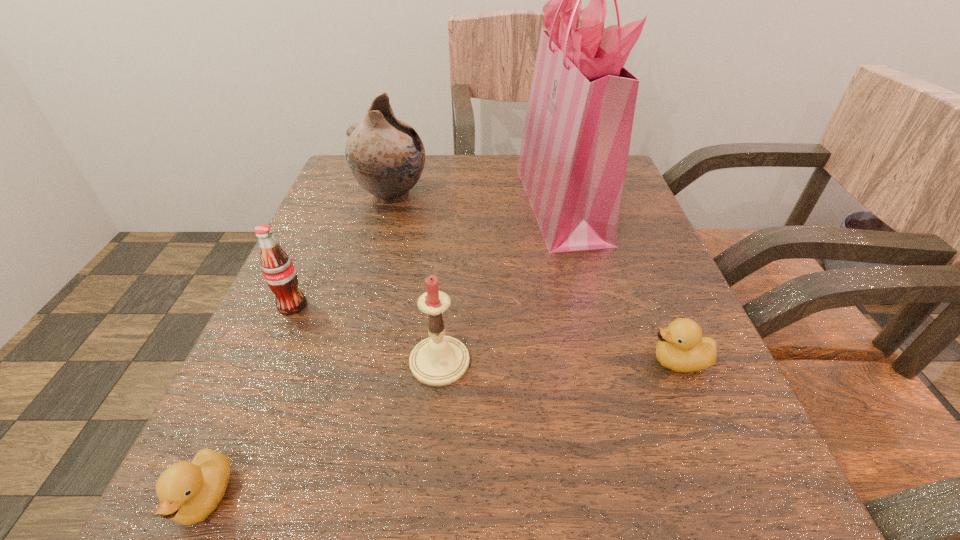
You are a GUI agent. You are given a task and a screenshot of the screen. Output one action in this format:
    pyautogui.click(x=<x>, y=<y>)
    Task: Click on the vacant space at the far left corner
    This screenshot has width=960, height=540.
    Given the screenshot: What is the action you would take?
    pyautogui.click(x=363, y=204)

In the image, there is a desktop. Identify the location of blank space at the near right corner. The height and width of the screenshot is (540, 960). (709, 496).

The image size is (960, 540). What are the coordinates of `free area in between the nearer duckling and the fourth nearest object` in the screenshot? It's located at (249, 401).

The height and width of the screenshot is (540, 960). Find the location of `vacant space that's between the soda and the farther duckling`. vacant space that's between the soda and the farther duckling is located at coordinates (486, 333).

Locate an element on the screen. This screenshot has width=960, height=540. unoccupied position between the third farthest object and the farther duckling is located at coordinates (486, 333).

Locate an element on the screen. The width and height of the screenshot is (960, 540). vacant area that lies between the fourth object from right to left and the farther duckling is located at coordinates point(536,279).

Where is `vacant area that lies between the nearest object and the candle`? The width and height of the screenshot is (960, 540). vacant area that lies between the nearest object and the candle is located at coordinates (323, 429).

I want to click on vacant region between the third object from right to left and the soda, so click(366, 333).

Locate an element on the screen. The height and width of the screenshot is (540, 960). free space between the pottery and the fourth nearest object is located at coordinates (342, 251).

Where is `free space between the second tallest object and the farther duckling`? This screenshot has height=540, width=960. free space between the second tallest object and the farther duckling is located at coordinates (536, 279).